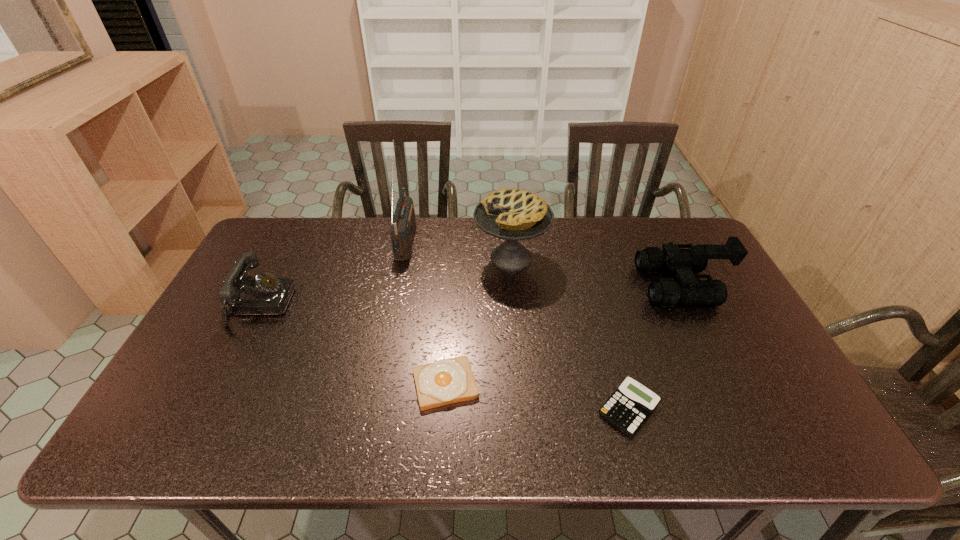
The image size is (960, 540). In order to click on pie positioned at the far edge in this screenshot , I will do `click(511, 214)`.

Identify the location of object positioned at the near edge. (628, 408).

Locate an element on the screen. This screenshot has height=540, width=960. object that is at the left edge is located at coordinates (266, 294).

Locate an element on the screen. The height and width of the screenshot is (540, 960). object that is at the right edge is located at coordinates (666, 292).

This screenshot has width=960, height=540. I want to click on vacant space at the far edge of the desktop, so click(x=306, y=244).

Locate an element on the screen. This screenshot has width=960, height=540. vacant space at the near edge of the desktop is located at coordinates (382, 450).

Identify the location of free region at the left edge of the desktop. (267, 269).

In the image, there is a desktop. Find the location of `vacant space at the near left corner`. vacant space at the near left corner is located at coordinates (185, 451).

Where is `vacant space at the near right corner`? This screenshot has width=960, height=540. vacant space at the near right corner is located at coordinates (811, 441).

In order to click on blank region between the toast and the binoculars in this screenshot , I will do click(564, 335).